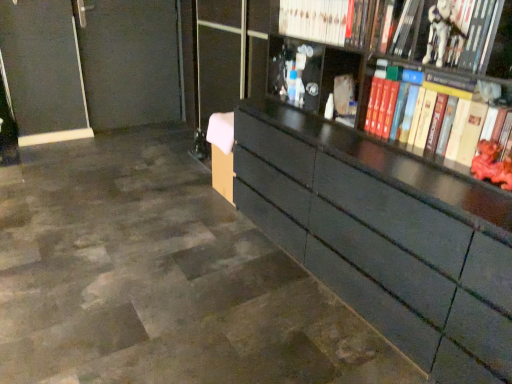
Question: Is hardcover book at upper right, positioned as the second book in top-to-bottom order, directly adjacent to hardcover book at right, acting as the 4th book starting from the top?

Choices:
 (A) no
 (B) yes

Answer: (A)

Question: From a real-world perspective, does hardcover book at upper right, positioned as the second book in top-to-bottom order, stand above hardcover book at right, acting as the 4th book starting from the top?

Choices:
 (A) no
 (B) yes

Answer: (B)

Question: Would you say hardcover book at upper right, acting as the 3th book starting from the bottom, is outside hardcover book at right, the first book when ordered from bottom to top?

Choices:
 (A) yes
 (B) no

Answer: (A)

Question: Does hardcover book at upper right, acting as the 3th book starting from the bottom, come behind hardcover book at right, the first book when ordered from bottom to top?

Choices:
 (A) yes
 (B) no

Answer: (A)

Question: Is hardcover book at right, acting as the 4th book starting from the top, inside hardcover book at upper right, acting as the 3th book starting from the bottom?

Choices:
 (A) no
 (B) yes

Answer: (A)

Question: Is hardcover book at upper right, acting as the 3th book starting from the bottom, far away from hardcover book at right, the first book when ordered from bottom to top?

Choices:
 (A) yes
 (B) no

Answer: (B)

Question: Is hardcover book at upper right, acting as the 3th book starting from the bottom, next to white plastic toy at upper right, which ranks as the 3th book in top-to-bottom order?

Choices:
 (A) yes
 (B) no

Answer: (B)

Question: Considering the relative sizes of hardcover book at upper right, acting as the 3th book starting from the bottom, and white plastic toy at upper right, which ranks as the 3th book in top-to-bottom order, in the image provided, is hardcover book at upper right, acting as the 3th book starting from the bottom, taller than white plastic toy at upper right, which ranks as the 3th book in top-to-bottom order,?

Choices:
 (A) yes
 (B) no

Answer: (A)

Question: Is hardcover book at upper right, positioned as the second book in top-to-bottom order, oriented towards white plastic toy at upper right, acting as the 2th book starting from the bottom?

Choices:
 (A) yes
 (B) no

Answer: (B)

Question: Can you confirm if hardcover book at upper right, acting as the 3th book starting from the bottom, is bigger than white plastic toy at upper right, acting as the 2th book starting from the bottom?

Choices:
 (A) no
 (B) yes

Answer: (A)

Question: Does hardcover book at upper right, positioned as the second book in top-to-bottom order, appear on the right side of white plastic toy at upper right, which ranks as the 3th book in top-to-bottom order?

Choices:
 (A) yes
 (B) no

Answer: (B)

Question: Considering the relative positions of hardcover book at upper right, positioned as the second book in top-to-bottom order, and white plastic toy at upper right, which ranks as the 3th book in top-to-bottom order, in the image provided, is hardcover book at upper right, positioned as the second book in top-to-bottom order, in front of white plastic toy at upper right, which ranks as the 3th book in top-to-bottom order,?

Choices:
 (A) no
 (B) yes

Answer: (A)

Question: From a real-world perspective, is hardcover book at right, the first book when ordered from bottom to top, located higher than white glossy book at upper center, the 1th book when ordered from top to bottom?

Choices:
 (A) no
 (B) yes

Answer: (A)